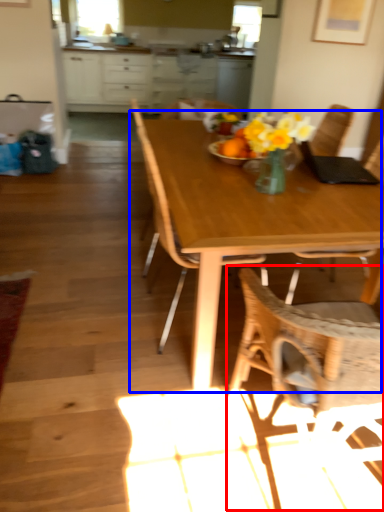
Question: Among these objects, which one is nearest to the camera, chair (highlighted by a red box) or kitchen & dining room table (highlighted by a blue box)?

Choices:
 (A) chair
 (B) kitchen & dining room table

Answer: (A)